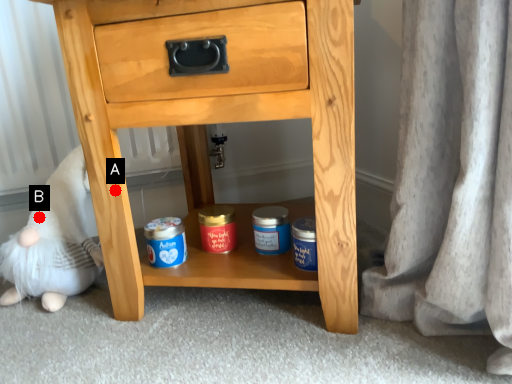
Question: Two points are circled on the image, labeled by A and B beside each circle. Which point appears farthest from the camera in this image?

Choices:
 (A) A is further
 (B) B is further

Answer: (B)